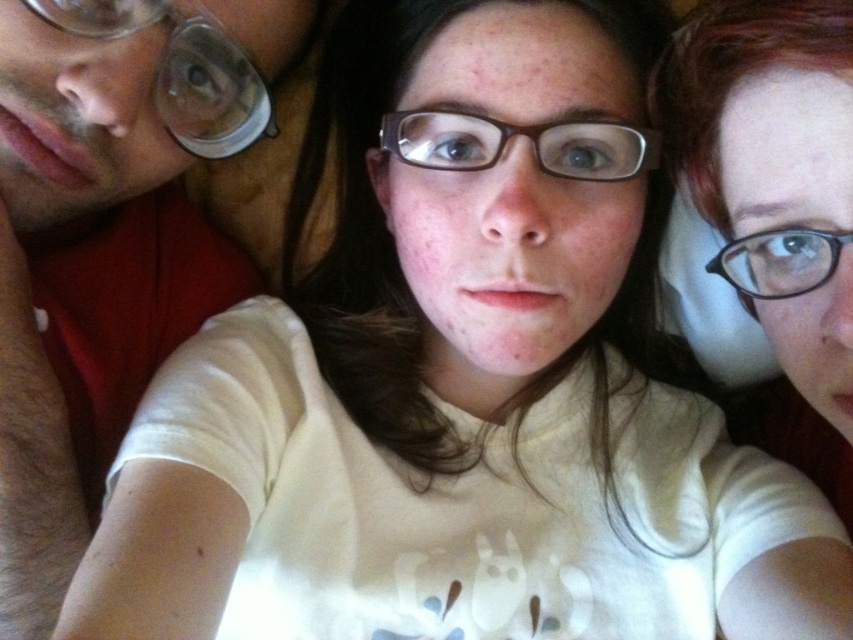
Who is taller, brown plastic glasses at center or clear plastic glasses at upper right?

brown plastic glasses at center

Does point (611, 156) lie behind point (796, 291)?

Yes, it is.

You are a GUI agent. You are given a task and a screenshot of the screen. Output one action in this format:
    pyautogui.click(x=<x>, y=<y>)
    Task: Click on the brown plastic glasses at center
    The width and height of the screenshot is (853, 640).
    Given the screenshot: What is the action you would take?
    pyautogui.click(x=521, y=134)

Is matte plastic glasses at upper left above clear plastic glasses at upper right?

Indeed, matte plastic glasses at upper left is positioned over clear plastic glasses at upper right.

Which is behind, point (258, 122) or point (747, 264)?

The point (258, 122) is behind.

Identify the location of matte plastic glasses at upper left. The width and height of the screenshot is (853, 640). (181, 68).

Is matte plastic glasses at upper left smaller than brown plastic glasses at center?

No.

Does matte plastic glasses at upper left appear on the right side of brown plastic glasses at center?

Incorrect, matte plastic glasses at upper left is not on the right side of brown plastic glasses at center.

At what (x,y) coordinates should I click in order to perform the action: click on matte plastic glasses at upper left. Please return your answer as a coordinate pair (x, y). This screenshot has width=853, height=640. Looking at the image, I should click on (181, 68).